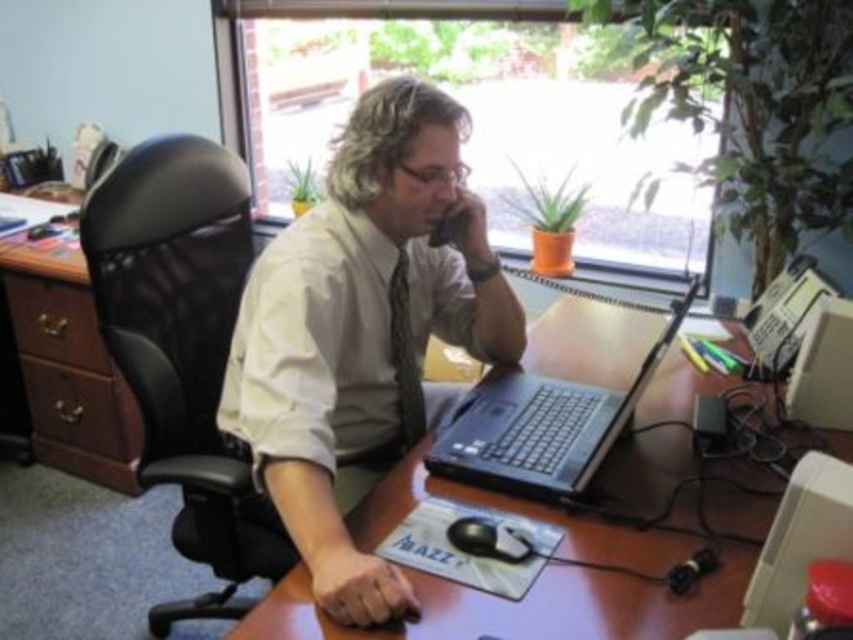
You are organizing the desk and need to place a new item between the black plastic laptop at center and the black plastic computer at lower right. Based on their positions, where should you place the new item?

The new item should be placed between the black plastic laptop at center and the black plastic computer at lower right, as the laptop is on the left side of the computer. This will ensure the item is positioned appropriately between them.

You are standing in the office and want to place a new 1 foot tall plant on the desk. The plant must be placed at point (x=154, y=189). Will the plant fit without exceeding the desk boundaries?

The point (x=154, y=189) is 4.94 feet away from the camera. However, the desk dimensions are not provided, so it is impossible to determine if the plant will fit within the desk boundaries.